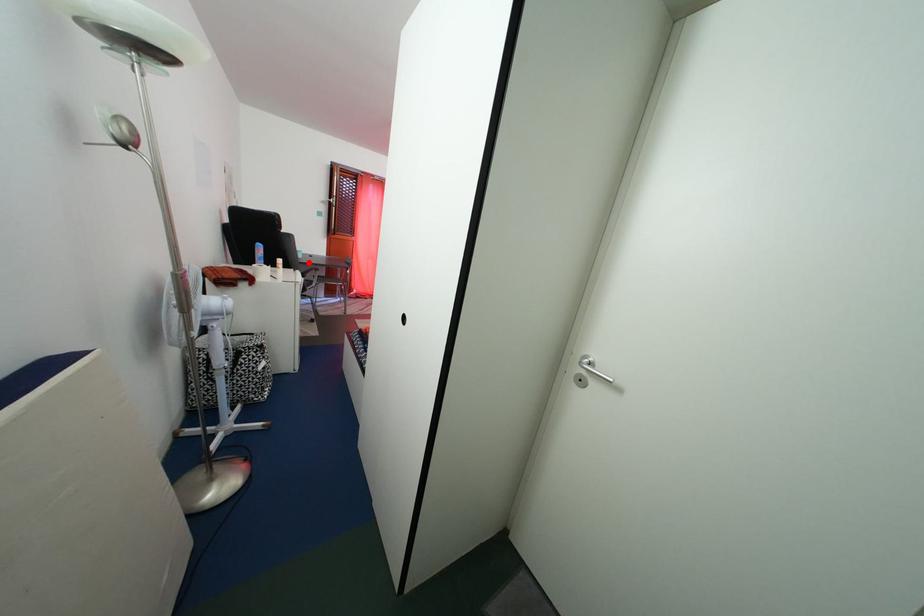
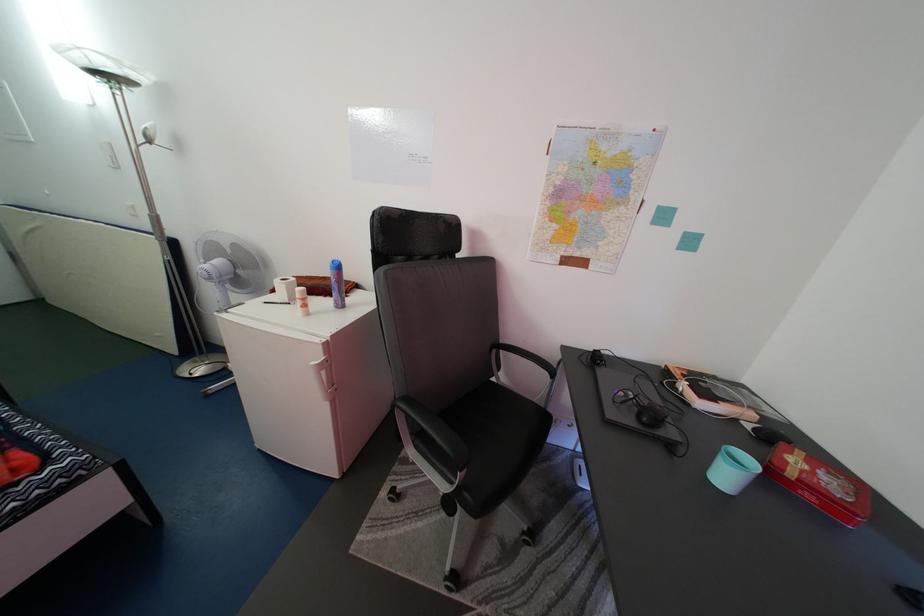
Question: I am providing you with two images of the same scene from different viewpoints. A red point is marked on the first image. Is the red point's position out of view in image 2?

Choices:
 (A) Yes
 (B) No

Answer: (B)